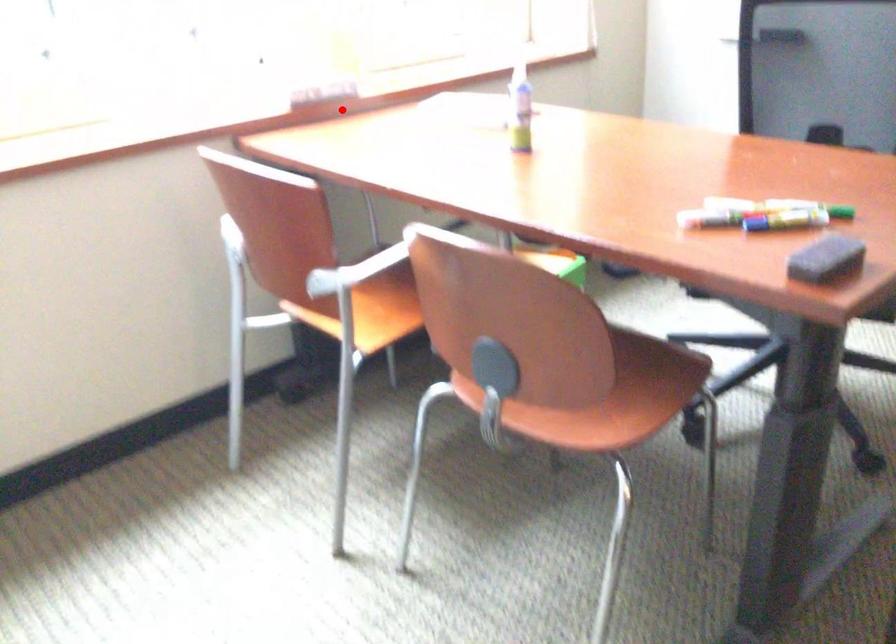
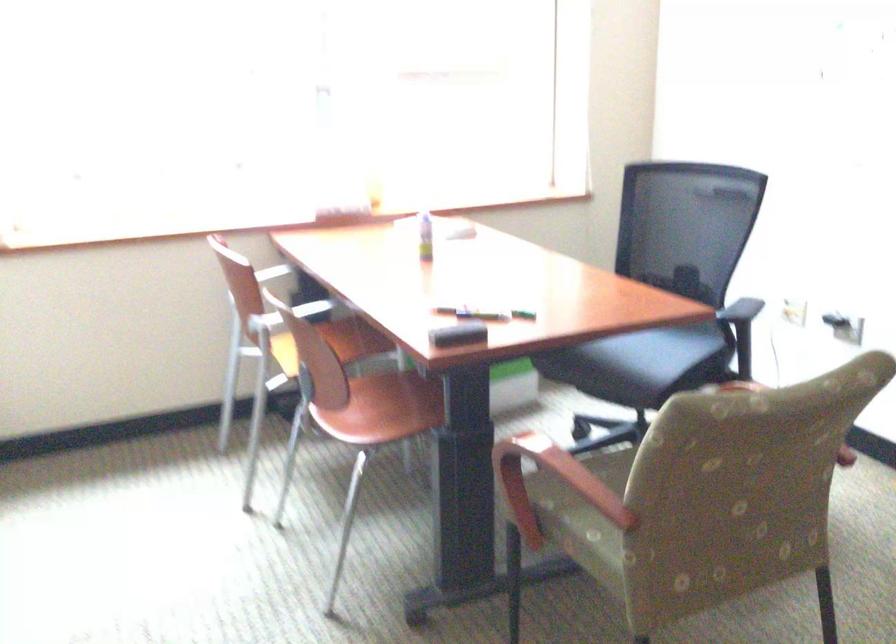
Question: I am providing you with two images of the same scene from different viewpoints. In image1, a red point is highlighted. Considering the same 3D point in image2, which of the following is correct?

Choices:
 (A) It is closer
 (B) It is farther

Answer: (B)